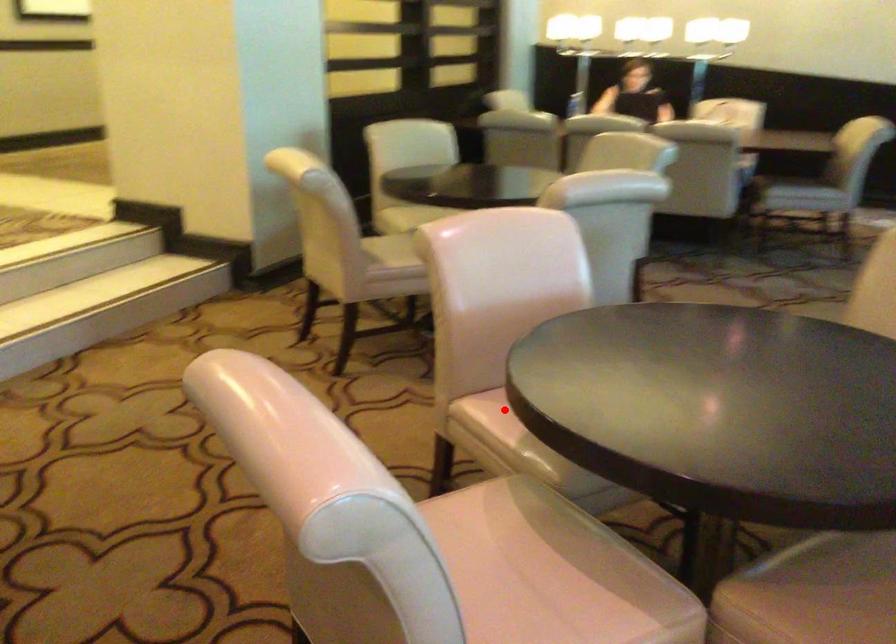
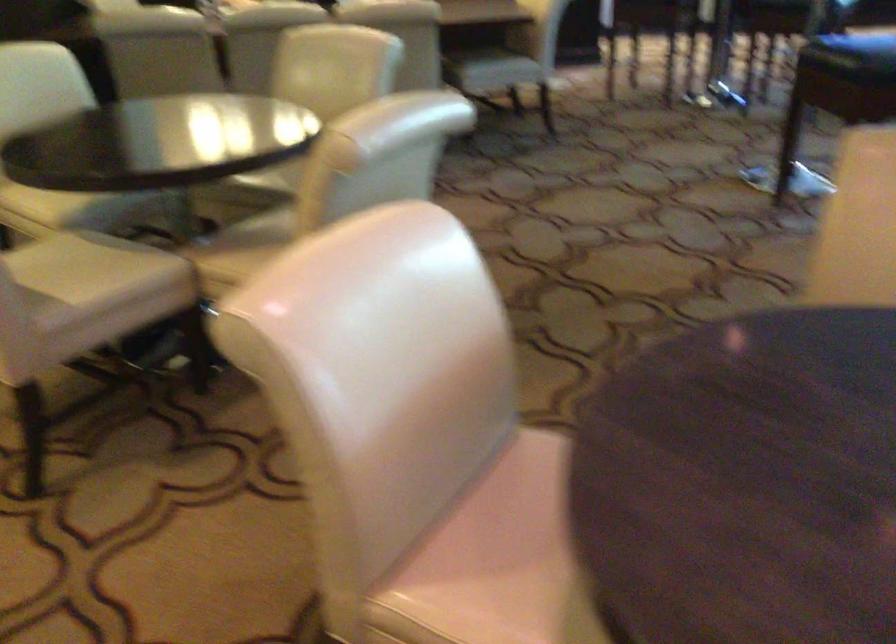
Question: I am providing you with two images of the same scene from different viewpoints. In image1, a red point is highlighted. Considering the same 3D point in image2, which of the following is correct?

Choices:
 (A) It is closer
 (B) It is farther

Answer: (A)